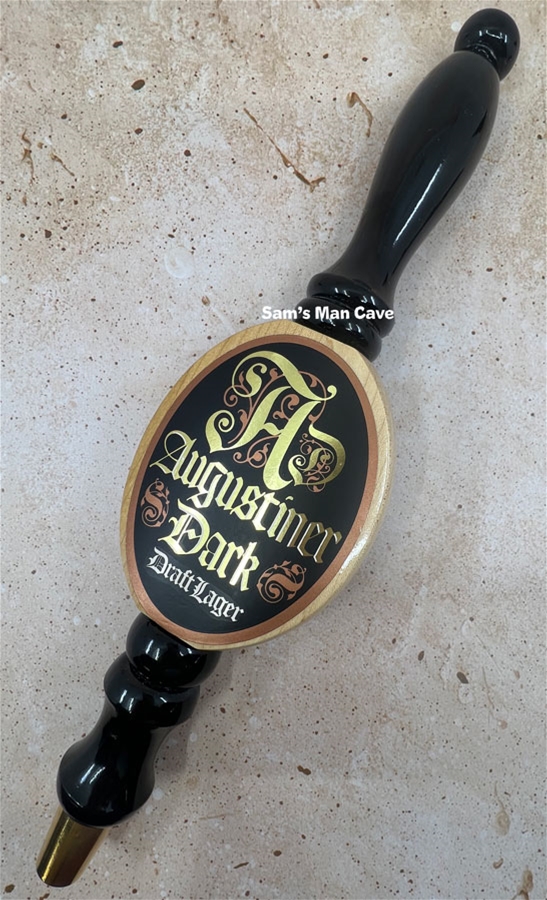
Where is `black handle`? The image size is (547, 900). black handle is located at coordinates (408, 196), (129, 734).